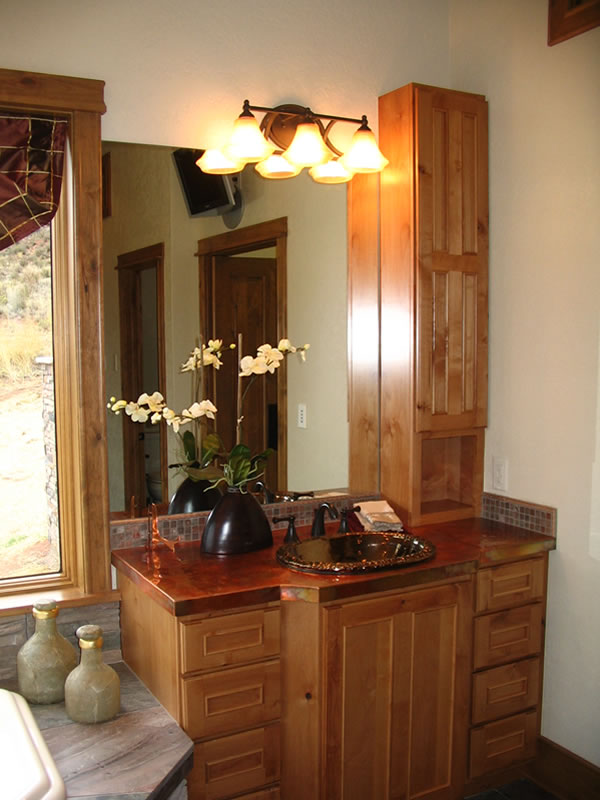
The image size is (600, 800). Identify the location of outlet. (495, 468).